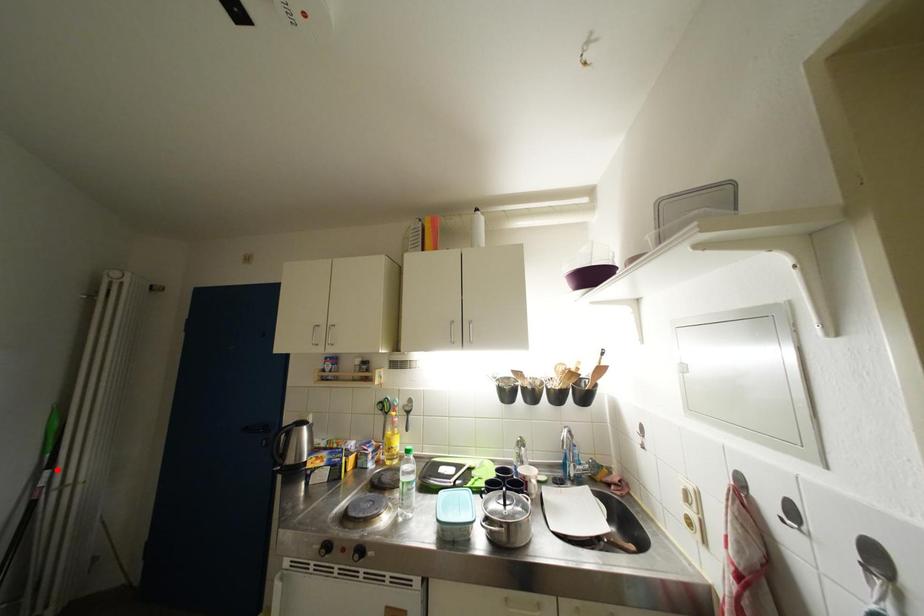
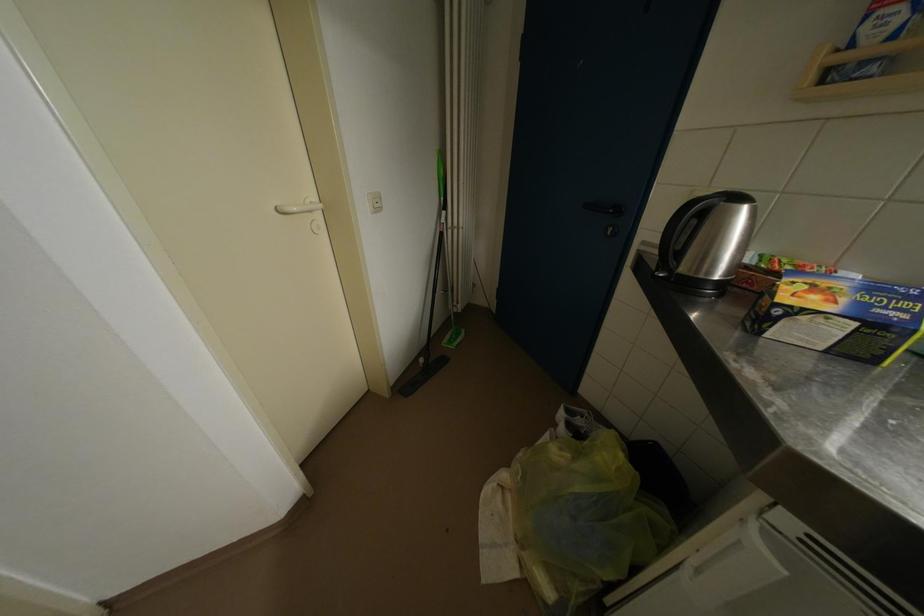
Question: A red point is marked in image1. In image2, is the corresponding 3D point closer to the camera or farther? Reply with the corresponding letter.

Choices:
 (A) The corresponding 3D point is closer.
 (B) The corresponding 3D point is farther.

Answer: (A)